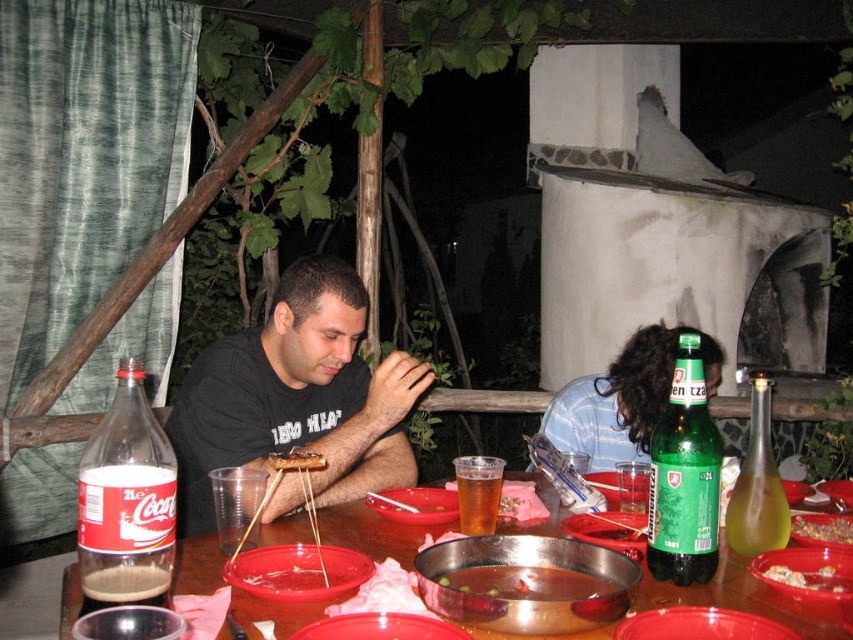
Question: Does translucent plastic table at center have a lesser width compared to brown crumbly bread at center?

Choices:
 (A) yes
 (B) no

Answer: (B)

Question: Which of these objects is positioned farthest from the smooth plastic bowl at center?

Choices:
 (A) shiny metallic pot at center
 (B) brown crumbly bread at center

Answer: (A)

Question: Can you confirm if translucent plastic table at center is smaller than dark blue shirt at center?

Choices:
 (A) yes
 (B) no

Answer: (A)

Question: Does translucent plastic table at center appear under brown crumbly bread at center?

Choices:
 (A) no
 (B) yes

Answer: (B)

Question: Considering the real-world distances, which object is farthest from the translucent plastic table at center?

Choices:
 (A) black matte shirt at center
 (B) shiny metallic pot at center
 (C) translucent plastic cup at table center

Answer: (A)

Question: Among these points, which one is farthest from the camera?

Choices:
 (A) (653, 362)
 (B) (320, 557)
 (C) (335, 371)

Answer: (A)